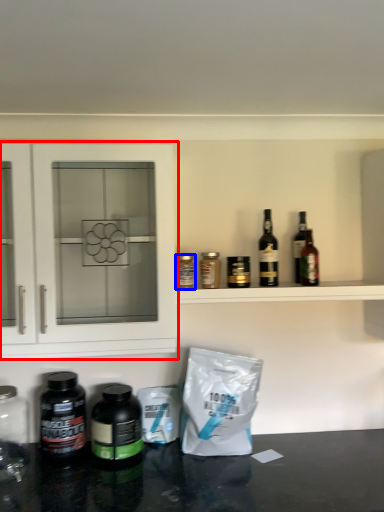
Question: Among these objects, which one is farthest to the camera, cabinetry (highlighted by a red box) or bottle (highlighted by a blue box)?

Choices:
 (A) cabinetry
 (B) bottle

Answer: (B)